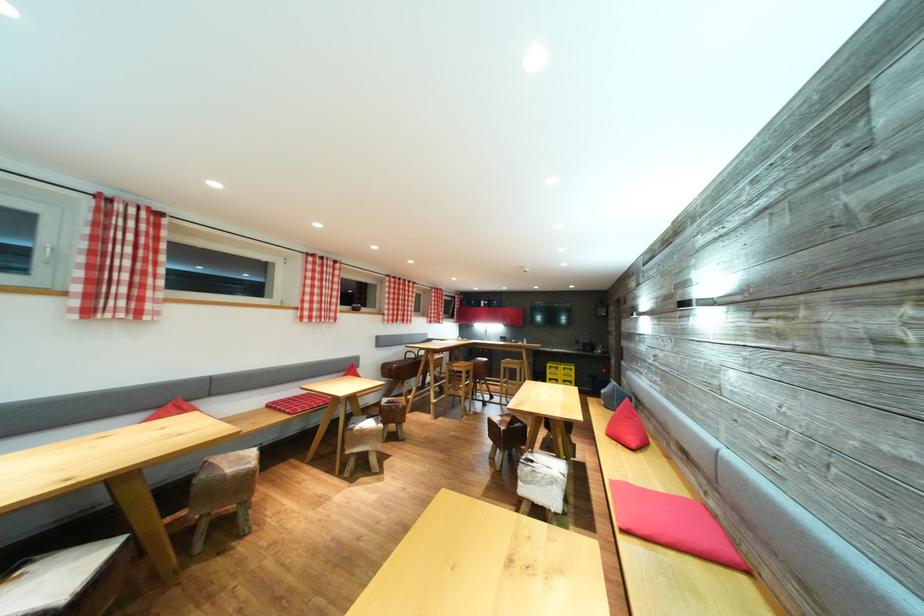
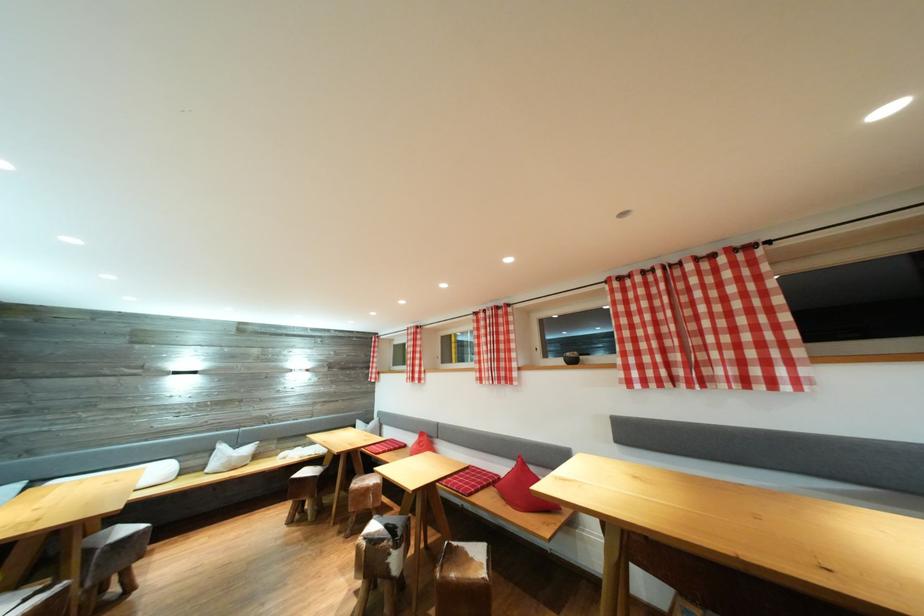
In the second image, find the point that corresponds to the point at 399,281 in the first image.

(631, 278)